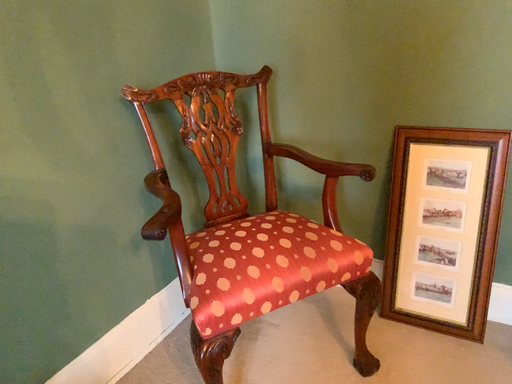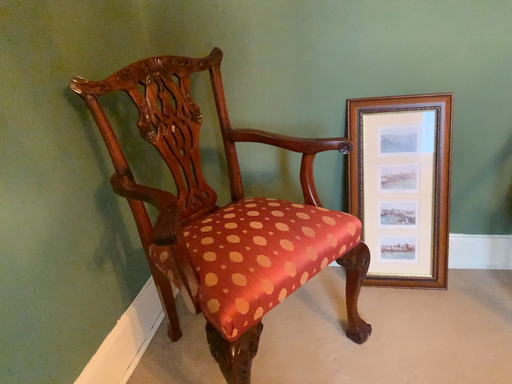
Question: How did the camera likely rotate when shooting the video?

Choices:
 (A) rotated right
 (B) rotated left

Answer: (A)